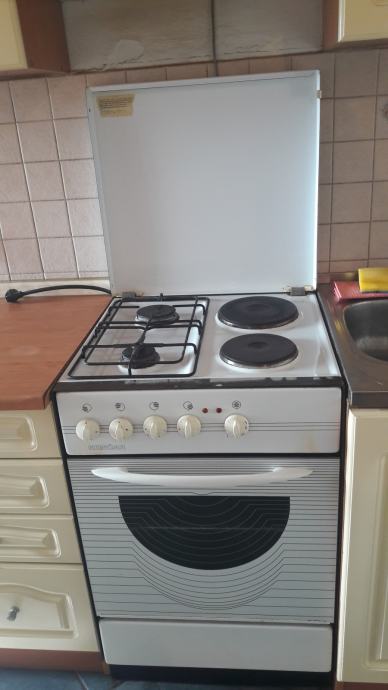
Find the location of a particular element. The width and height of the screenshot is (388, 690). stainless sink is located at coordinates (373, 342).